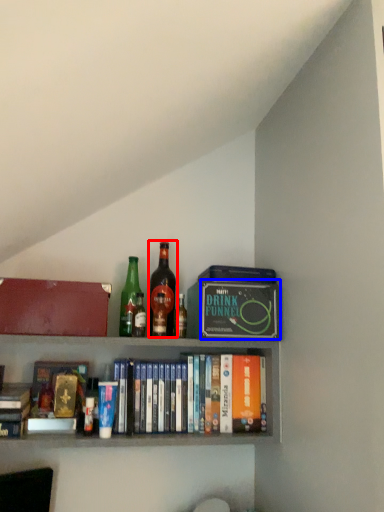
Question: Which of the following is the closest to the observer, bottle (highlighted by a red box) or paperback book (highlighted by a blue box)?

Choices:
 (A) bottle
 (B) paperback book

Answer: (B)